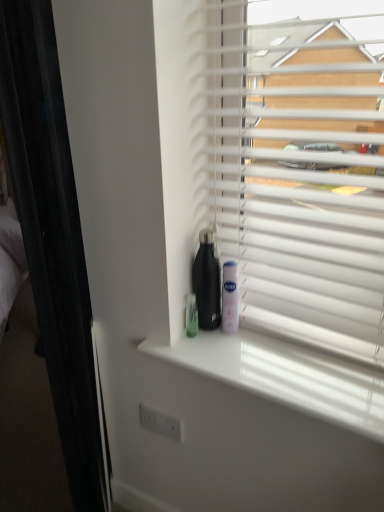
Where is `vacant space situated on the left part of white plastic mouthwash at center`? The image size is (384, 512). vacant space situated on the left part of white plastic mouthwash at center is located at coordinates (178, 343).